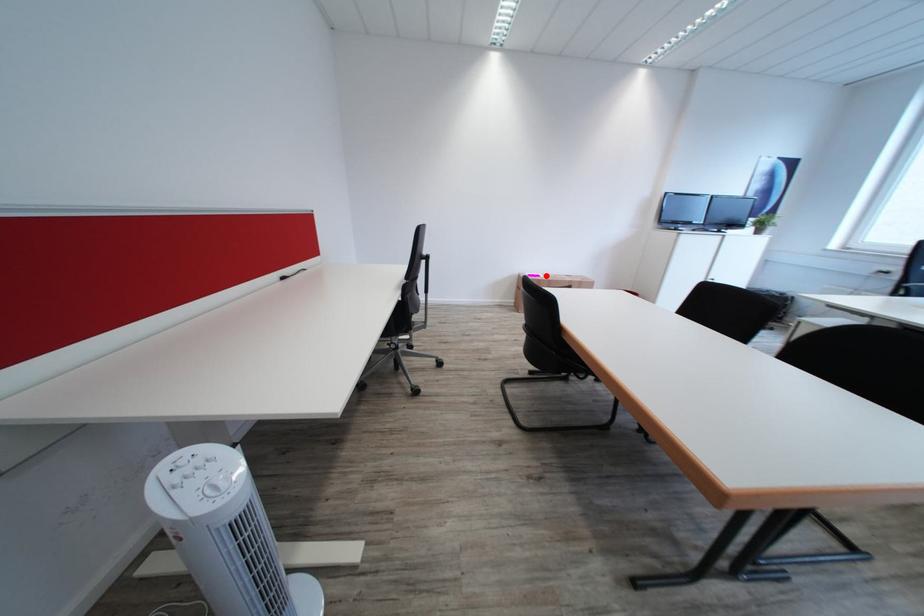
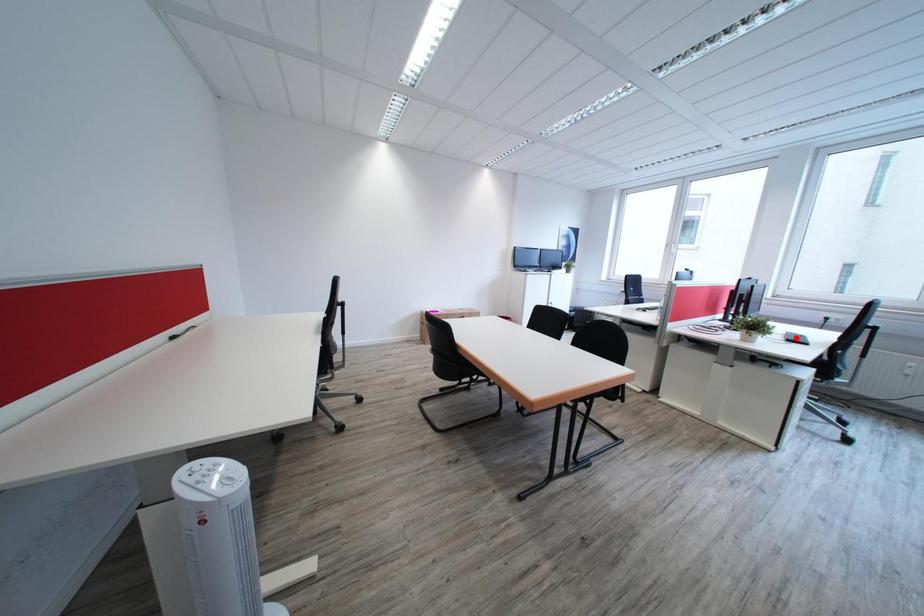
I am providing you with two images of the same scene from different viewpoints. A red point is marked on the first image and another point is marked on the second image. Are the points marked in image1 and image2 representing the same 3D position?

No